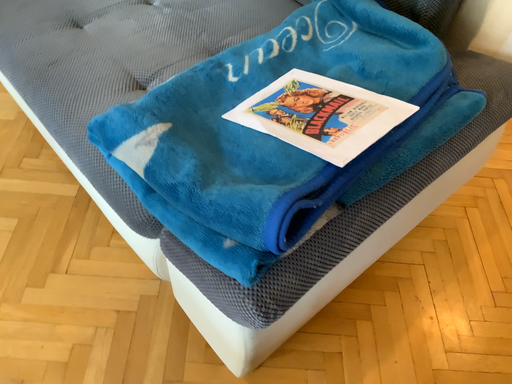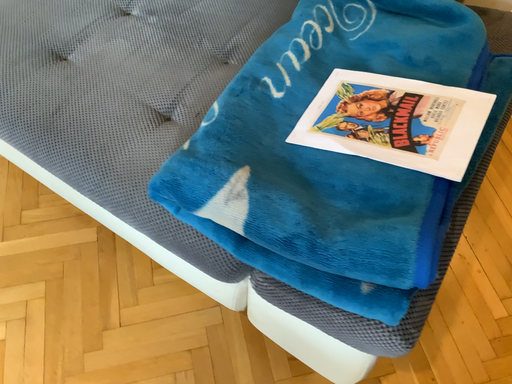
Question: Which way did the camera rotate in the video?

Choices:
 (A) rotated left
 (B) rotated right

Answer: (B)